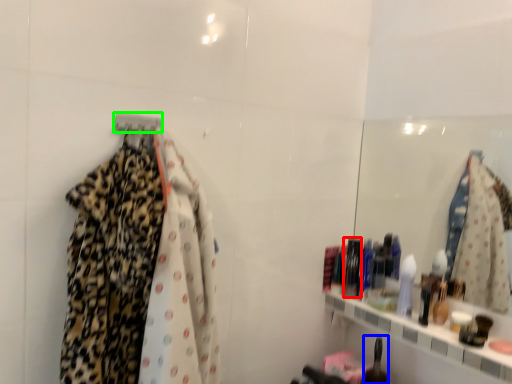
Question: Which object is the farthest from toiletry (highlighted by a red box)? Choose among these: toiletry (highlighted by a blue box) or hanger (highlighted by a green box).

Choices:
 (A) toiletry
 (B) hanger

Answer: (B)